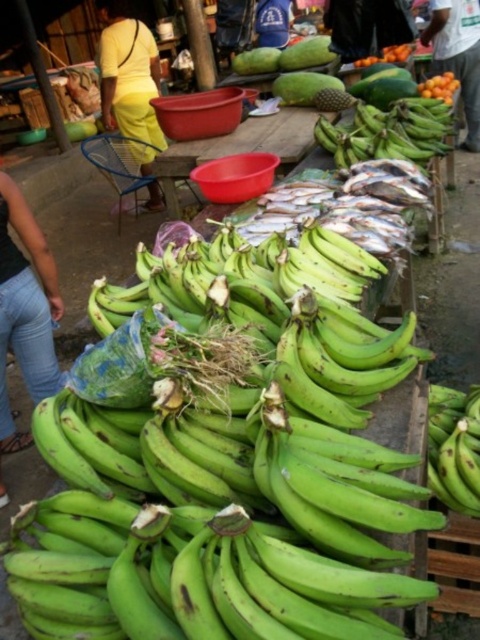
Who is lower down, yellow fabric pants at upper left or orange matte at upper center?

yellow fabric pants at upper left

Find the location of `yellow fabric pants at upper left`. yellow fabric pants at upper left is located at coordinates (128, 74).

Can you confirm if green matte bananas at upper center is shorter than green matte bananas at center?

No.

Between point (431, 109) and point (431, 424), which one is positioned behind?

Positioned behind is point (431, 109).

Consider the image. Who is more forward, (379, 140) or (462, 506)?

Point (462, 506) is in front.

Identify the location of green matte bananas at upper center. Image resolution: width=480 pixels, height=640 pixels. (387, 132).

Who is higher up, white plastic bag at upper right or orange matte at upper center?

orange matte at upper center

Between white plastic bag at upper right and orange matte at upper center, which one appears on the right side from the viewer's perspective?

white plastic bag at upper right is more to the right.

Identify the location of white plastic bag at upper right. (457, 54).

Locate an element on the screen. The image size is (480, 640). white plastic bag at upper right is located at coordinates (457, 54).